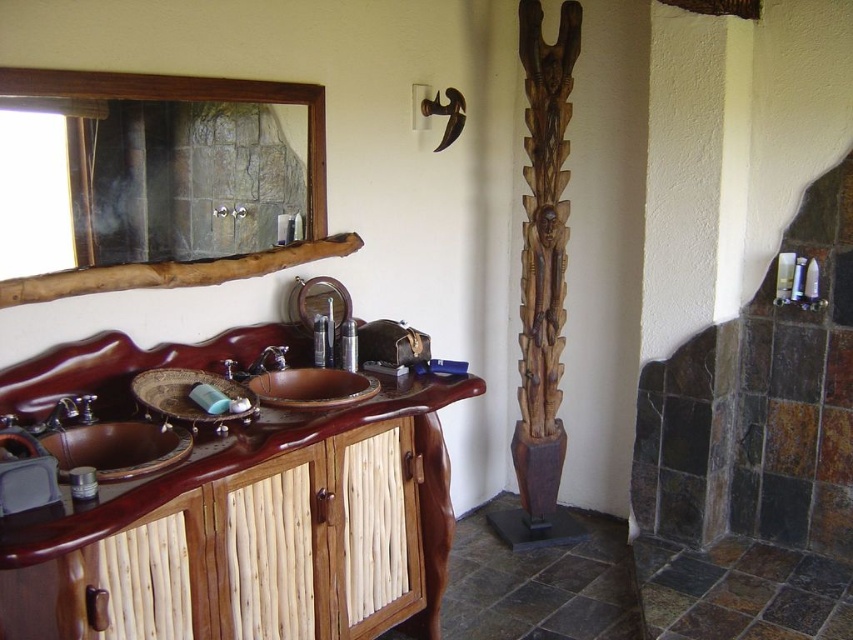
Based on the photo, you are standing in the bathroom and want to place a decorative item on the wooden frame mirror at upper left. The mirror is at coordinates 0.156, 0.224. What is the exact 2D coordinate point where you should place the item?

The exact 2D coordinate point to place the decorative item on the wooden frame mirror at upper left is at point (190, 99).

You are designing a layout for a bathroom magazine spread. You need to place a caption that mentions both the wooden frame mirror at upper left and the brushed metal faucet at left. Based on their sizes, where should the caption be placed to best highlight their features?

The wooden frame mirror at upper left is larger than the brushed metal faucet at left, so placing the caption closer to the wooden frame mirror at upper left would better emphasize its prominence while still acknowledging the brushed metal faucet at left.

In the bathroom scene described, where is the brown wood sink at left located in terms of coordinates?

The brown wood sink at left is located at point coordinates of (117, 449).